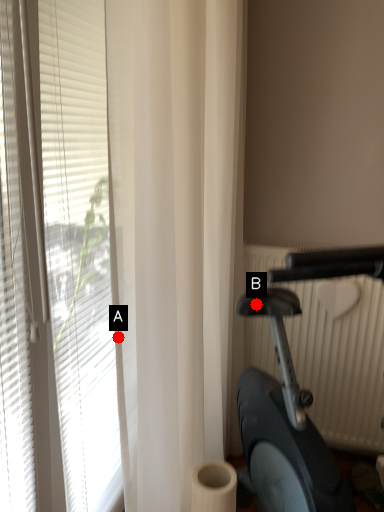
Question: Two points are circled on the image, labeled by A and B beside each circle. Which point is farther from the camera taking this photo?

Choices:
 (A) A is further
 (B) B is further

Answer: (B)